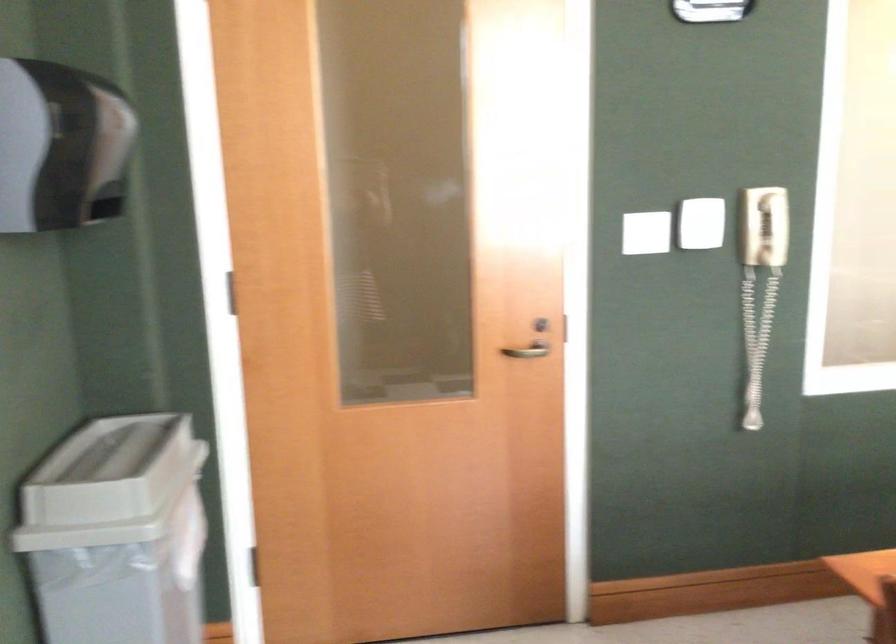
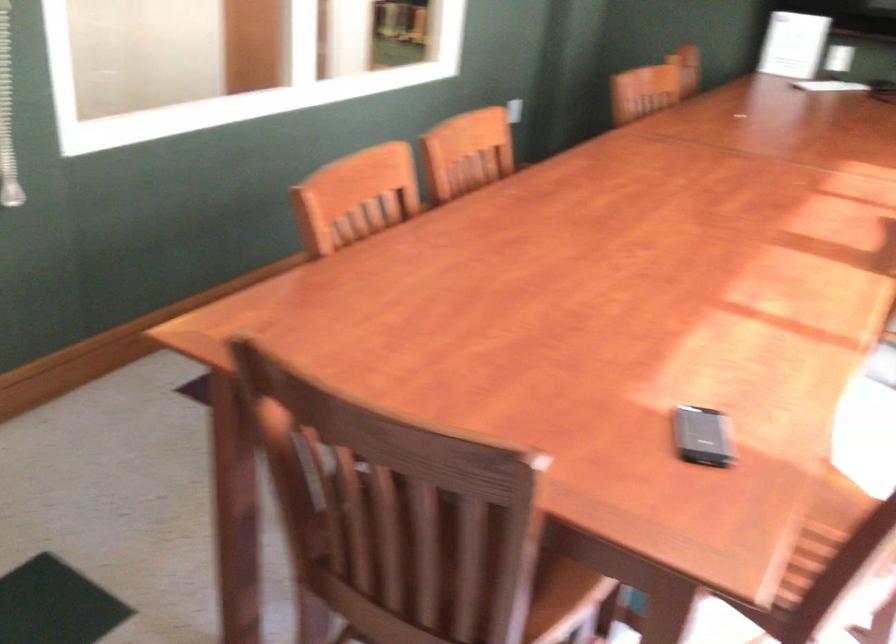
Based on the continuous images, in which direction is the camera rotating?

The camera rotated toward right-down.